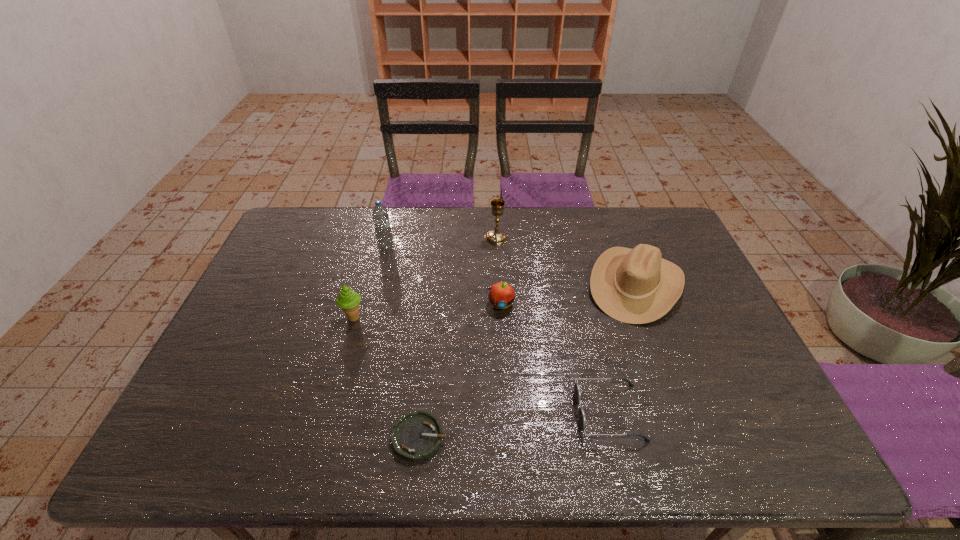
Find the location of `the tallest object`. the tallest object is located at coordinates (380, 216).

Identify the location of chalice. (496, 236).

Image resolution: width=960 pixels, height=540 pixels. I want to click on icecream, so click(x=348, y=300).

Where is `cowboy hat`? This screenshot has height=540, width=960. cowboy hat is located at coordinates (637, 286).

Where is `the third shortest object`? Image resolution: width=960 pixels, height=540 pixels. the third shortest object is located at coordinates (501, 294).

Where is `the sixth tallest object`? Image resolution: width=960 pixels, height=540 pixels. the sixth tallest object is located at coordinates (577, 393).

I want to click on ashtray, so (416, 436).

Locate an element on the screen. Image resolution: width=960 pixels, height=540 pixels. the third object from left to right is located at coordinates (416, 436).

This screenshot has width=960, height=540. Find the location of `free space located 0.190m on the back of the tallest object`. free space located 0.190m on the back of the tallest object is located at coordinates (396, 212).

Find the location of a particular element. blank area located 0.150m on the left of the chalice is located at coordinates (441, 238).